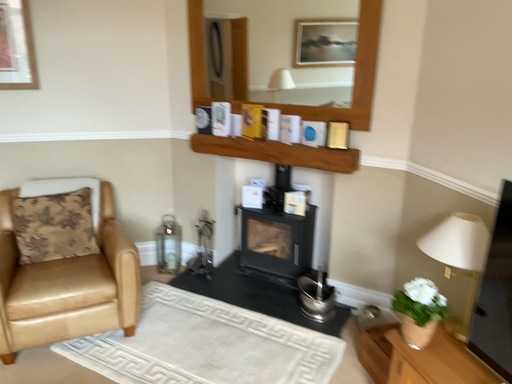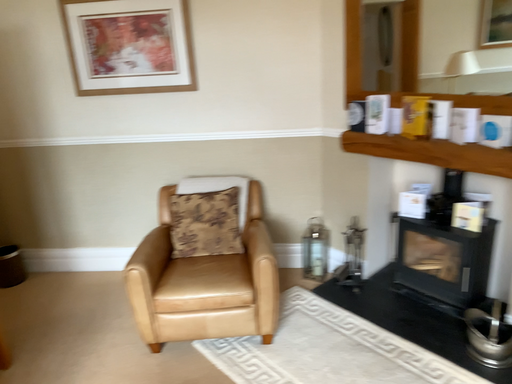
Question: How did the camera likely rotate when shooting the video?

Choices:
 (A) rotated left
 (B) rotated right

Answer: (A)